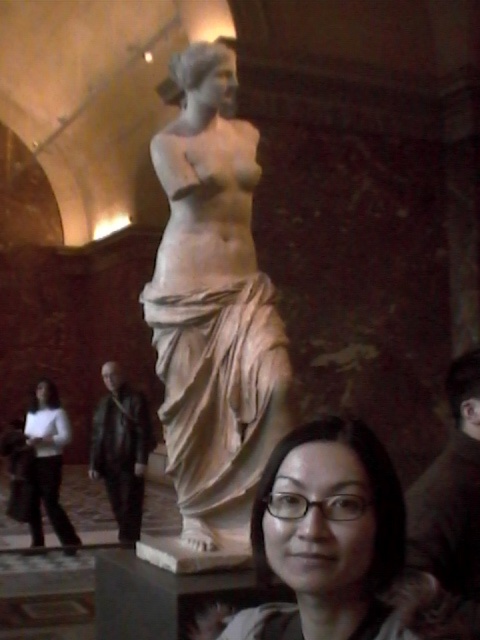
In the scene shown: Can you confirm if white marble statue at center is taller than white matte pants at lower left?

Yes, white marble statue at center is taller than white matte pants at lower left.

The width and height of the screenshot is (480, 640). What do you see at coordinates (214, 307) in the screenshot? I see `white marble statue at center` at bounding box center [214, 307].

Which is in front, point (240, 216) or point (70, 436)?

Point (240, 216) is in front.

Identify the location of white marble statue at center. click(214, 307).

Can you confirm if white marble statue at center is positioned to the right of matte white statue at center?

Incorrect, white marble statue at center is not on the right side of matte white statue at center.

Does white marble statue at center appear over matte white statue at center?

Result: Yes.

Locate an element on the screen. The width and height of the screenshot is (480, 640). white marble statue at center is located at coordinates click(214, 307).

You are a GUI agent. You are given a task and a screenshot of the screen. Output one action in this format:
    pyautogui.click(x=<x>, y=<y>)
    Task: Click on the white marble statue at center
    
    Given the screenshot: What is the action you would take?
    pyautogui.click(x=214, y=307)

Does matte white statue at center have a lesser height compared to white matte pants at lower left?

Indeed, matte white statue at center has a lesser height compared to white matte pants at lower left.

Between point (388, 460) and point (40, 397), which one is positioned in front?

Point (388, 460) is more forward.

Locate an element on the screen. This screenshot has width=480, height=640. matte white statue at center is located at coordinates (328, 538).